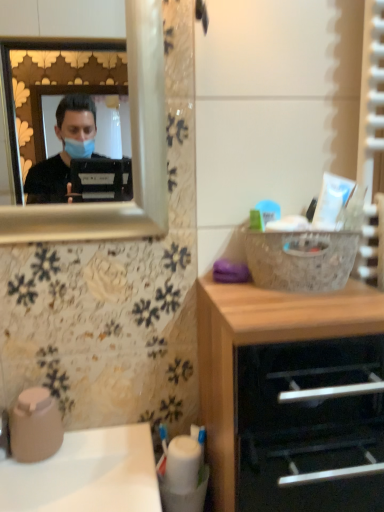
The width and height of the screenshot is (384, 512). Identify the location of free point above wooden chest of drawers at lower right (from a real-world perspective). (281, 301).